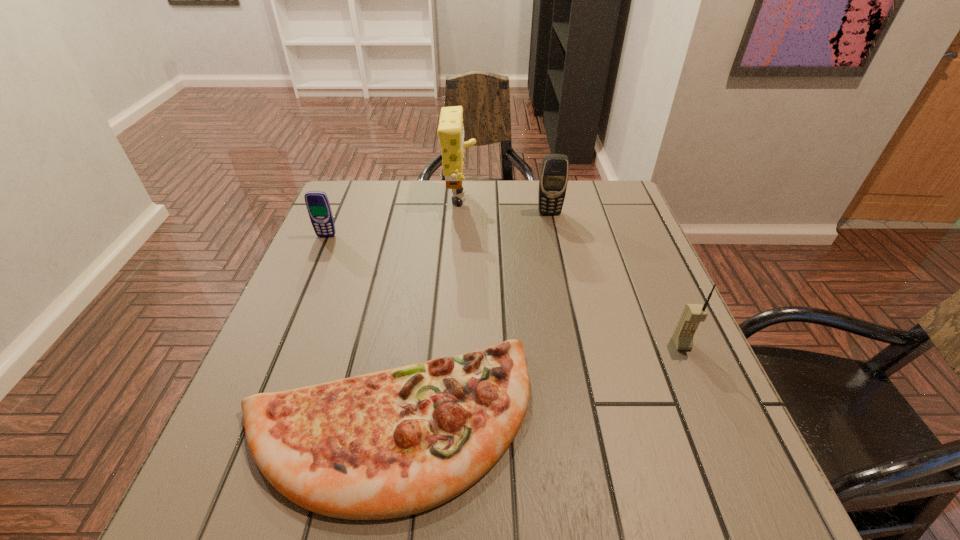
This screenshot has height=540, width=960. I want to click on cellular telephone that stands as the third closest to the sponge, so click(x=693, y=314).

Identify the location of free space that satisfies the following two spatial constraints: 1. on the face of the sponge; 2. on the front-facing side of the second nearest cellular telephone. This screenshot has width=960, height=540. (458, 237).

At what (x,y) coordinates should I click in order to perform the action: click on free space that satisfies the following two spatial constraints: 1. on the front-facing side of the third nearest object; 2. on the left side of the shortest object. Please return your answer as a coordinate pair (x, y). This screenshot has height=540, width=960. Looking at the image, I should click on (247, 423).

Locate an element on the screen. The image size is (960, 540). vacant space that satisfies the following two spatial constraints: 1. on the front-facing side of the nearest object; 2. on the right side of the second farthest cellular telephone is located at coordinates (x=247, y=423).